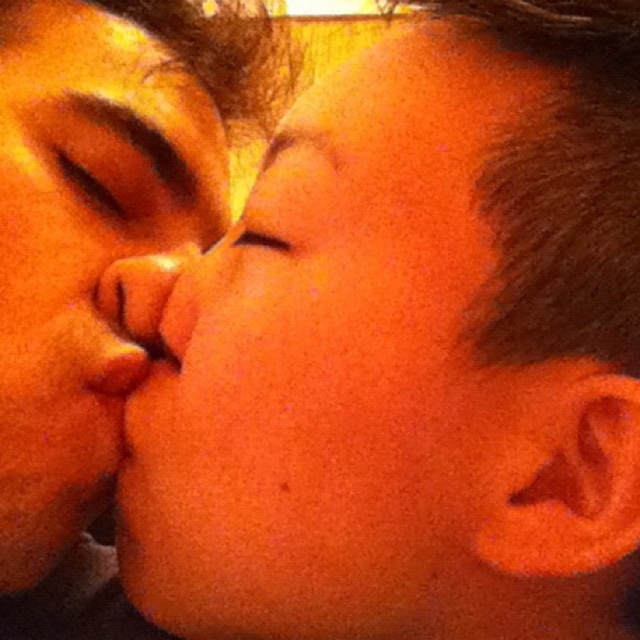
Based on the scene description, which eye is positioned higher between the brown matte eye at upper left and the matte orange eye at center?

The brown matte eye at upper left is positioned higher than the matte orange eye at center.

You are a photographer adjusting the focus of your camera. You need to ensure that both the matte skin face at center and the brown matte eye at upper left are in sharp focus. Given that your camera can only focus precisely on objects within a 2.5 inch range, will both objects be in focus?

The distance between the matte skin face at center and the brown matte eye at upper left is 2.34 inches, which is within the 2.5 inch range. Therefore, both objects will be in sharp focus.

Based on the scene description, which object is positioned to the left of the other? The matte skin face at center and the brown matte eye at upper left.

The matte skin face at center is to the left of brown matte eye at upper left according to the description.